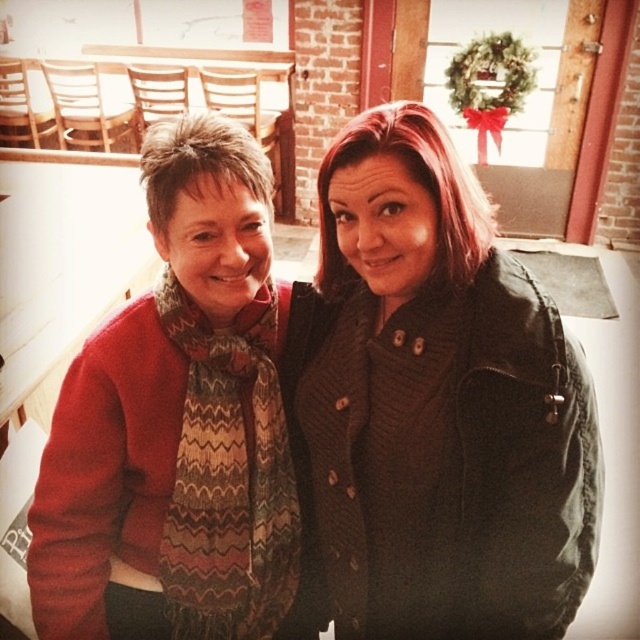
Which is above, matte black jacket at center or knitted scarf at left?

matte black jacket at center

Between matte black jacket at center and knitted scarf at left, which one appears on the left side from the viewer's perspective?

knitted scarf at left

Which is in front, point (518, 604) or point (156, 556)?

Positioned in front is point (518, 604).

Identify the location of matte black jacket at center. (440, 404).